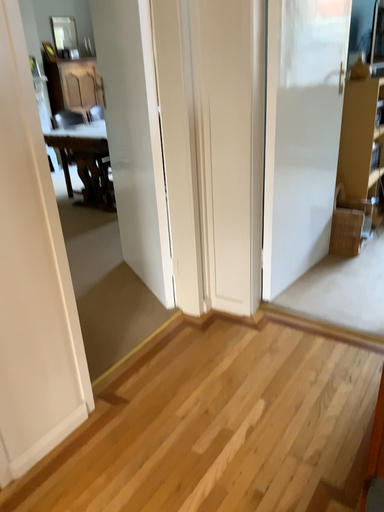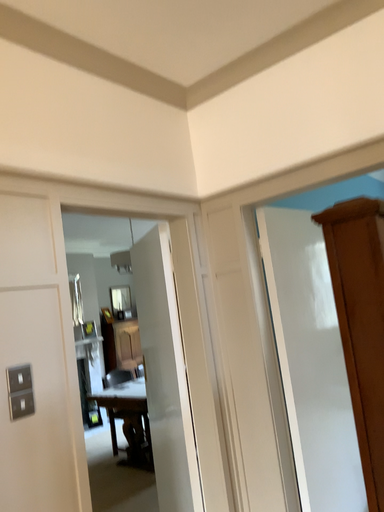
Question: Which way did the camera rotate in the video?

Choices:
 (A) rotated downward
 (B) rotated upward

Answer: (B)